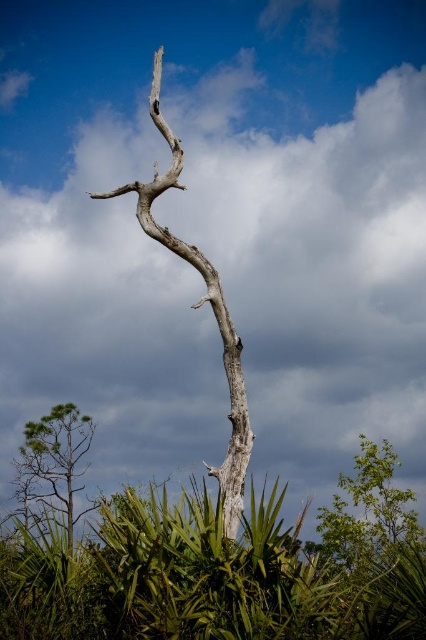
Does gray textured branch at center appear over green leafy tree at lower left?

Indeed, gray textured branch at center is positioned over green leafy tree at lower left.

Does point (233, 406) lie behind point (49, 429)?

No, it is in front of (49, 429).

Who is more distant from viewer, (233, 428) or (40, 465)?

Positioned behind is point (40, 465).

Where is `gray textured branch at center`? The height and width of the screenshot is (640, 426). gray textured branch at center is located at coordinates (196, 307).

Is green leafy tree at lower right below green leafy tree at lower left?

Indeed, green leafy tree at lower right is positioned under green leafy tree at lower left.

Is green leafy tree at lower right smaller than green leafy tree at lower left?

Incorrect, green leafy tree at lower right is not smaller in size than green leafy tree at lower left.

You are a GUI agent. You are given a task and a screenshot of the screen. Output one action in this format:
    pyautogui.click(x=<x>, y=<y>)
    Task: Click on the green leafy tree at lower right
    The image size is (426, 640).
    Given the screenshot: What is the action you would take?
    pyautogui.click(x=368, y=512)

In the scene shown: Is gray textured branch at center taller than green leafy tree at lower right?

Correct, gray textured branch at center is much taller as green leafy tree at lower right.

How much distance is there between gray textured branch at center and green leafy tree at lower right?

The distance of gray textured branch at center from green leafy tree at lower right is 20.51 feet.

Is point (244, 385) behind point (374, 474)?

No, it is in front of (374, 474).

The image size is (426, 640). Identify the location of gray textured branch at center. tap(196, 307).